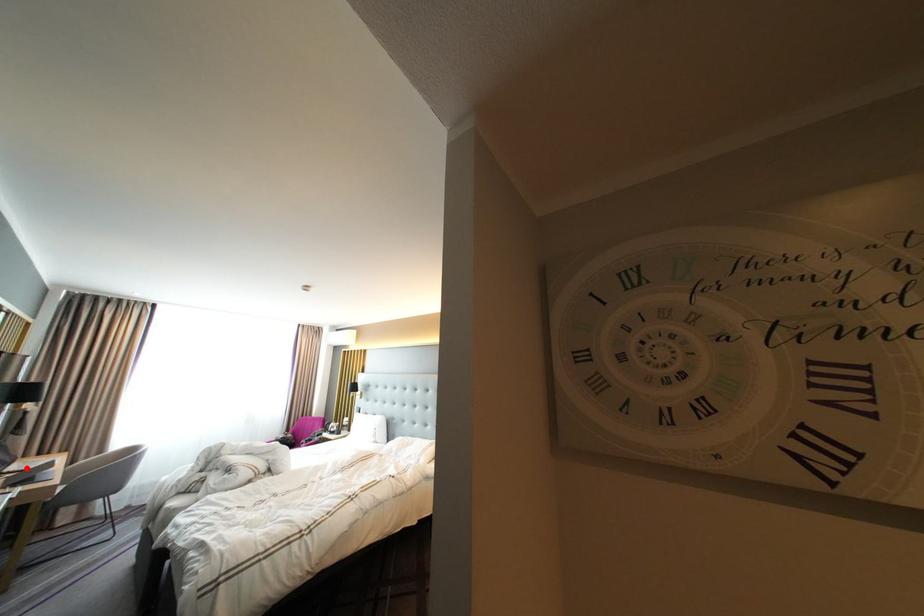
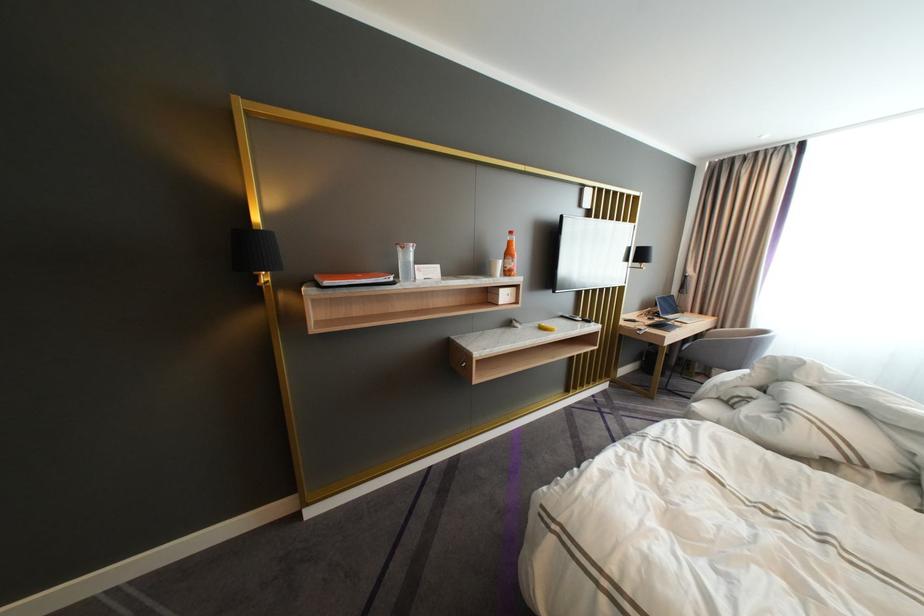
In the second image, find the point that corresponds to the highlighted location in the first image.

(683, 317)